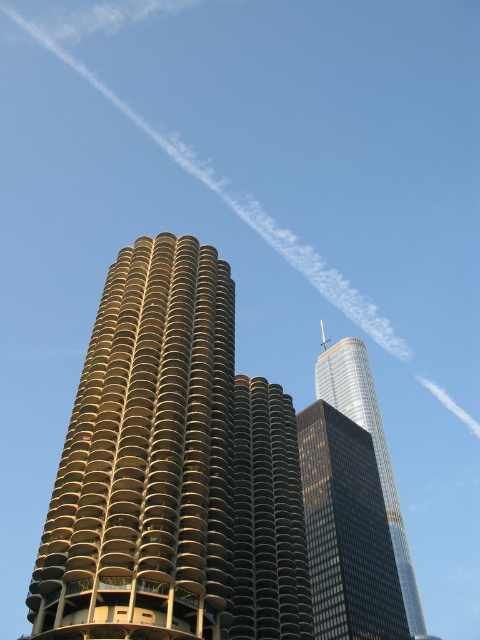
Can you confirm if gold metallic building at center is bigger than shiny glass skyscraper at upper right?

Actually, gold metallic building at center might be smaller than shiny glass skyscraper at upper right.

Is gold metallic building at center to the left of shiny glass skyscraper at upper right from the viewer's perspective?

Correct, you'll find gold metallic building at center to the left of shiny glass skyscraper at upper right.

Where is `gold metallic building at center`? The width and height of the screenshot is (480, 640). gold metallic building at center is located at coordinates (146, 458).

At what (x,y) coordinates should I click in order to perform the action: click on gold metallic building at center. Please return your answer as a coordinate pair (x, y). The image size is (480, 640). Looking at the image, I should click on (146, 458).

Between point (284, 422) and point (392, 472), which one is positioned behind?

Positioned behind is point (392, 472).

Is dark gray concrete building at center bigger than shiny glass skyscraper at upper right?

No, dark gray concrete building at center is not bigger than shiny glass skyscraper at upper right.

I want to click on dark gray concrete building at center, so click(x=267, y=516).

Is point (136, 384) less distant than point (252, 541)?

That is True.

From the picture: How far apart are gold metallic building at center and dark gray concrete building at center?

gold metallic building at center is 12.67 meters from dark gray concrete building at center.

Which is behind, point (210, 358) or point (248, 550)?

Positioned behind is point (248, 550).

Locate an element on the screen. The height and width of the screenshot is (640, 480). gold metallic building at center is located at coordinates (146, 458).